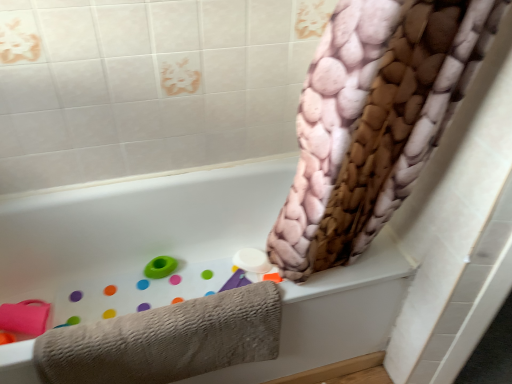
Question: Can you see green rubber ring at lower left touching beige textured towel at lower left?

Choices:
 (A) no
 (B) yes

Answer: (A)

Question: Is beige textured towel at lower left completely or partially inside green rubber ring at lower left?

Choices:
 (A) no
 (B) yes

Answer: (A)

Question: Can you confirm if green rubber ring at lower left is smaller than beige textured towel at lower left?

Choices:
 (A) yes
 (B) no

Answer: (A)

Question: Would you consider green rubber ring at lower left to be distant from beige textured towel at lower left?

Choices:
 (A) yes
 (B) no

Answer: (B)

Question: Is green rubber ring at lower left to the right of beige textured towel at lower left from the viewer's perspective?

Choices:
 (A) yes
 (B) no

Answer: (B)

Question: From a real-world perspective, is beige textured towel at lower left physically located above or below green rubber ring at lower left?

Choices:
 (A) above
 (B) below

Answer: (A)

Question: From the image's perspective, is beige textured towel at lower left positioned above or below green rubber ring at lower left?

Choices:
 (A) below
 (B) above

Answer: (A)

Question: Considering the positions of beige textured towel at lower left and green rubber ring at lower left in the image, is beige textured towel at lower left bigger or smaller than green rubber ring at lower left?

Choices:
 (A) big
 (B) small

Answer: (A)

Question: Considering the relative positions of beige textured towel at lower left and green rubber ring at lower left in the image provided, is beige textured towel at lower left to the left or to the right of green rubber ring at lower left?

Choices:
 (A) left
 (B) right

Answer: (B)

Question: From their relative heights in the image, would you say green rubber ring at lower left is taller or shorter than beige textured towel at lower left?

Choices:
 (A) short
 (B) tall

Answer: (A)

Question: From a real-world perspective, is green rubber ring at lower left positioned above or below beige textured towel at lower left?

Choices:
 (A) above
 (B) below

Answer: (B)

Question: Does point (144, 268) appear closer or farther from the camera than point (94, 360)?

Choices:
 (A) farther
 (B) closer

Answer: (A)

Question: In the image, is green rubber ring at lower left positioned in front of or behind beige textured towel at lower left?

Choices:
 (A) front
 (B) behind

Answer: (B)

Question: Is point (224, 377) positioned closer to the camera than point (133, 334)?

Choices:
 (A) closer
 (B) farther

Answer: (B)

Question: From a real-world perspective, is white matte bathtub at upper center positioned above or below beige textured towel at lower left?

Choices:
 (A) below
 (B) above

Answer: (A)